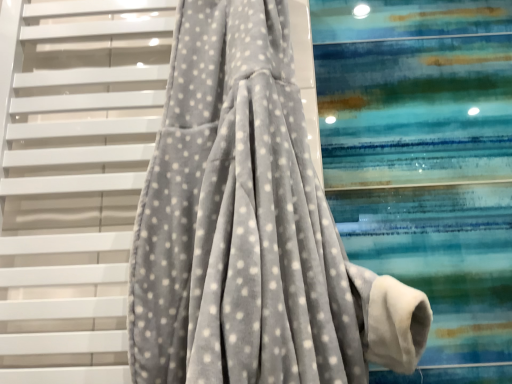
Question: Does gray velvety fabric at center lie in front of velvet grey robe at center?

Choices:
 (A) no
 (B) yes

Answer: (A)

Question: Is gray velvety fabric at center facing away from velvet grey robe at center?

Choices:
 (A) no
 (B) yes

Answer: (B)

Question: From a real-world perspective, is gray velvety fabric at center over velvet grey robe at center?

Choices:
 (A) yes
 (B) no

Answer: (A)

Question: Considering the relative sizes of gray velvety fabric at center and velvet grey robe at center in the image provided, is gray velvety fabric at center thinner than velvet grey robe at center?

Choices:
 (A) yes
 (B) no

Answer: (A)

Question: Can you confirm if gray velvety fabric at center is smaller than velvet grey robe at center?

Choices:
 (A) yes
 (B) no

Answer: (A)

Question: Can you confirm if gray velvety fabric at center is positioned to the right of velvet grey robe at center?

Choices:
 (A) no
 (B) yes

Answer: (A)

Question: From a real-world perspective, is velvet grey robe at center located beneath gray velvety fabric at center?

Choices:
 (A) no
 (B) yes

Answer: (B)

Question: From a real-world perspective, does velvet grey robe at center stand above gray velvety fabric at center?

Choices:
 (A) yes
 (B) no

Answer: (B)

Question: Does velvet grey robe at center turn towards gray velvety fabric at center?

Choices:
 (A) yes
 (B) no

Answer: (B)

Question: Is velvet grey robe at center not within gray velvety fabric at center?

Choices:
 (A) yes
 (B) no

Answer: (A)

Question: From the image's perspective, does velvet grey robe at center appear higher than gray velvety fabric at center?

Choices:
 (A) no
 (B) yes

Answer: (B)

Question: Considering the relative sizes of velvet grey robe at center and gray velvety fabric at center in the image provided, is velvet grey robe at center shorter than gray velvety fabric at center?

Choices:
 (A) no
 (B) yes

Answer: (B)

Question: In the image, is gray velvety fabric at center positioned in front of or behind velvet grey robe at center?

Choices:
 (A) behind
 (B) front

Answer: (A)